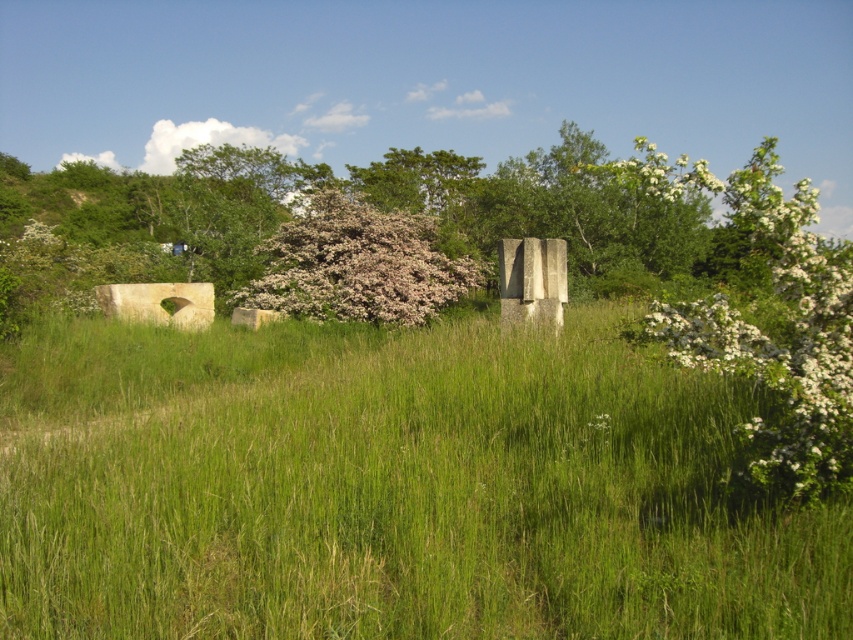
Which is more to the right, green grass at center or fluffy white blossoms at center?

green grass at center is more to the right.

Is green grass at center to the left of fluffy white blossoms at center from the viewer's perspective?

In fact, green grass at center is to the right of fluffy white blossoms at center.

Is point (514, 484) farther from viewer compared to point (412, 248)?

That is False.

Where is `green grass at center`? Image resolution: width=853 pixels, height=640 pixels. green grass at center is located at coordinates (392, 486).